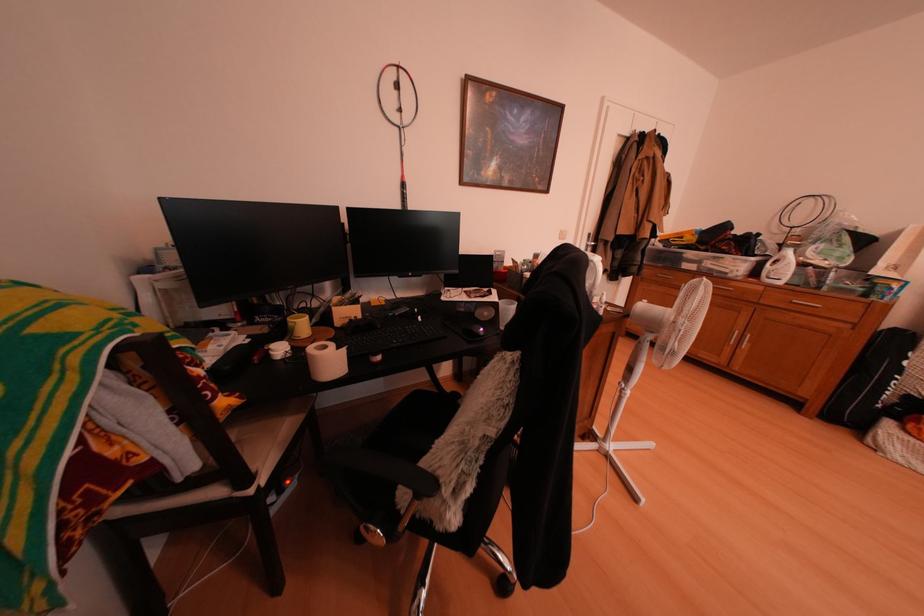
The image size is (924, 616). What do you see at coordinates (403, 195) in the screenshot?
I see `a badminton racket handle` at bounding box center [403, 195].